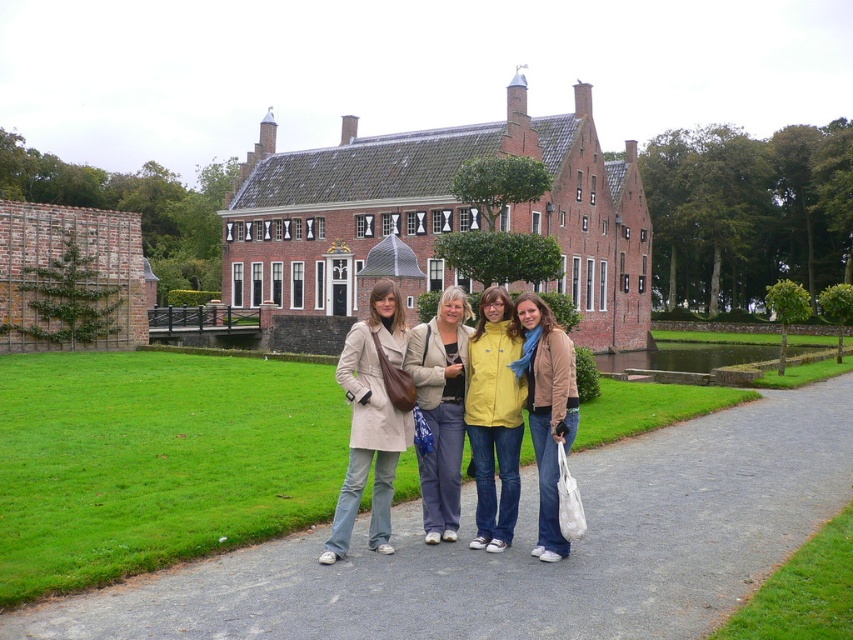
Question: Considering the relative positions of gray asphalt path at center and matte beige jacket at center in the image provided, where is gray asphalt path at center located with respect to matte beige jacket at center?

Choices:
 (A) below
 (B) above

Answer: (A)

Question: Can you confirm if beige fabric coat at center is bigger than light beige coat at center?

Choices:
 (A) no
 (B) yes

Answer: (A)

Question: Considering the real-world distances, which object is farthest from the matte beige jacket at center?

Choices:
 (A) yellow matte jacket at center
 (B) beige fabric coat at center
 (C) light beige coat at center

Answer: (B)

Question: Based on their relative distances, which object is nearer to the light beige coat at center?

Choices:
 (A) beige fabric coat at center
 (B) gray asphalt path at center

Answer: (A)

Question: Is beige fabric coat at center thinner than light beige coat at center?

Choices:
 (A) no
 (B) yes

Answer: (A)

Question: Which point appears closest to the camera in this image?

Choices:
 (A) [552, 524]
 (B) [395, 355]
 (C) [410, 364]

Answer: (A)